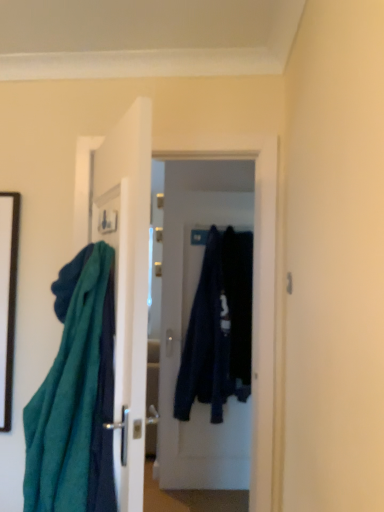
The height and width of the screenshot is (512, 384). Identify the location of free space in front of dark blue fabric at center, positioned as the 1th door in back-to-front order. (206, 497).